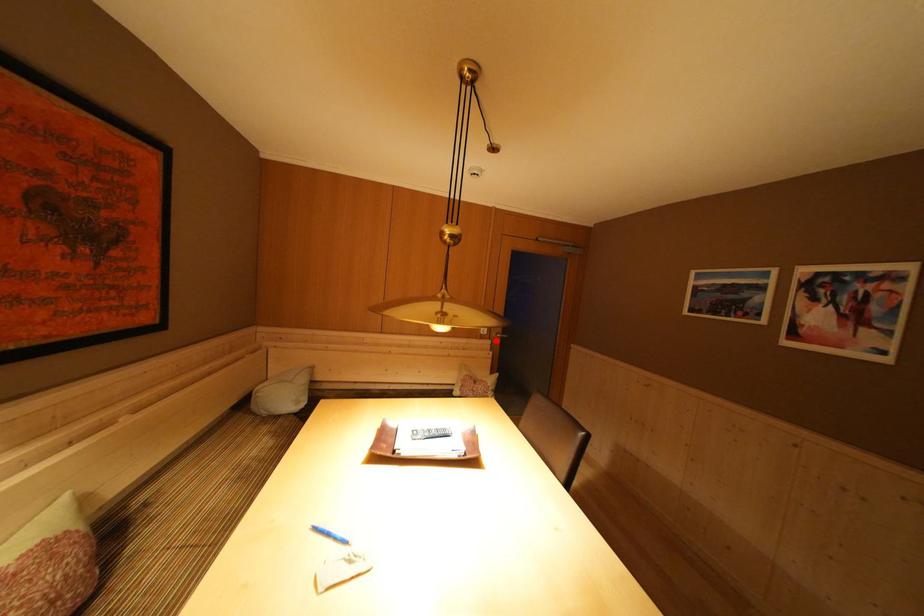
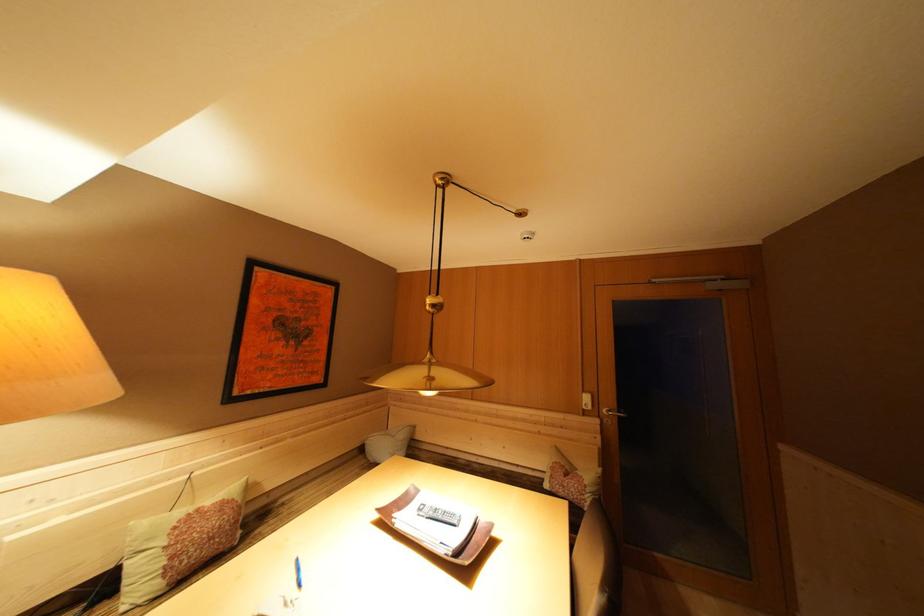
Question: I am providing you with two images of the same scene from different viewpoints. Image1 has a red point marked. In image2, the corresponding 3D location appears at what relative position? Reply with the corresponding letter.

Choices:
 (A) Closer
 (B) Farther

Answer: (B)